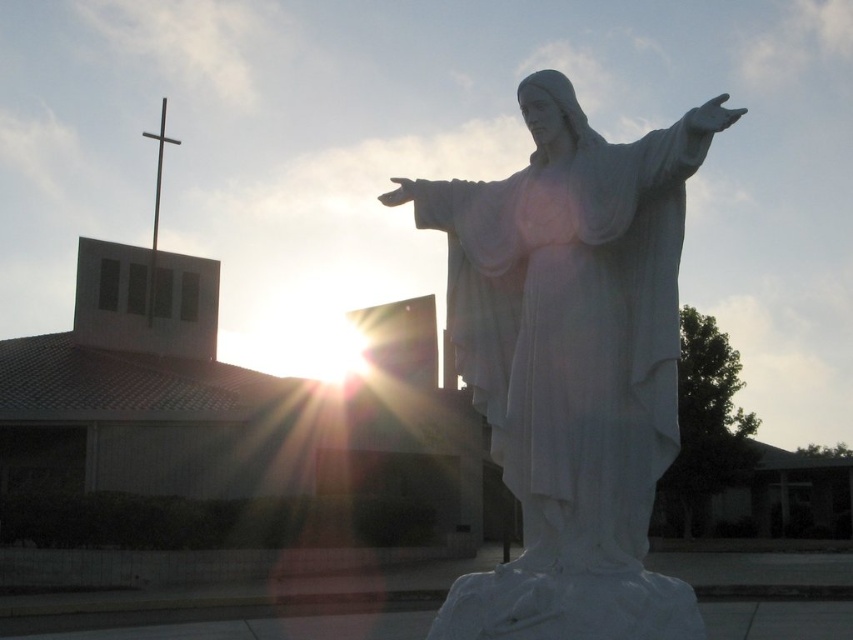
Question: Does white marble statue at center have a smaller size compared to metallic cross at upper left?

Choices:
 (A) no
 (B) yes

Answer: (B)

Question: Which of the following is the closest to the observer?

Choices:
 (A) (531, 509)
 (B) (152, 225)

Answer: (A)

Question: Which point is farther to the camera?

Choices:
 (A) white marble statue at center
 (B) metallic cross at upper left

Answer: (B)

Question: Is white marble statue at center closer to the viewer compared to metallic cross at upper left?

Choices:
 (A) yes
 (B) no

Answer: (A)

Question: Can you confirm if white marble statue at center is positioned to the right of metallic cross at upper left?

Choices:
 (A) yes
 (B) no

Answer: (A)